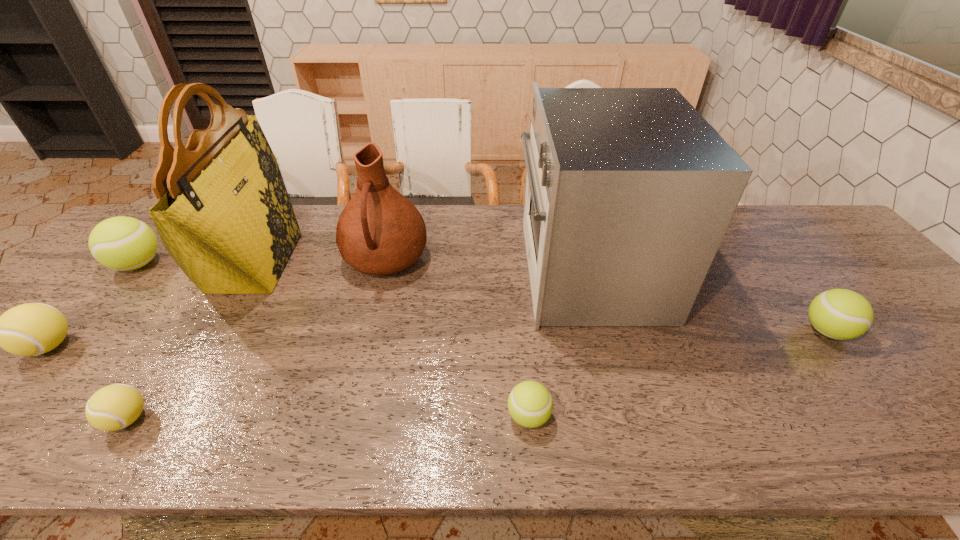
The image size is (960, 540). I want to click on the third tennis ball from left to right, so click(113, 407).

This screenshot has height=540, width=960. I want to click on the right yellow tennis ball, so click(113, 407).

Identify the location of the nearest green tennis ball. (530, 404).

Locate an element on the screen. The image size is (960, 540). the smallest green tennis ball is located at coordinates (530, 404).

You are a GUI agent. You are given a task and a screenshot of the screen. Output one action in this format:
    pyautogui.click(x=<x>, y=<y>)
    Task: Click on the vacant space situated on the front-facing side of the tote bag
    The image size is (960, 540).
    Given the screenshot: What is the action you would take?
    pyautogui.click(x=320, y=262)

Locate an element on the screen. vacant space located on the front panel of the toaster oven is located at coordinates (466, 271).

Find the location of a particular element. vacant space located on the front panel of the toaster oven is located at coordinates (437, 271).

The width and height of the screenshot is (960, 540). What are the coordinates of `vacant area situated 0.220m on the front panel of the toaster oven` in the screenshot? It's located at (441, 271).

What are the coordinates of `vacant point located 0.160m on the side of the sixth shortest object with the handle` in the screenshot? It's located at (367, 338).

The height and width of the screenshot is (540, 960). I want to click on vacant area situated 0.240m on the right of the fifth shortest object, so click(248, 265).